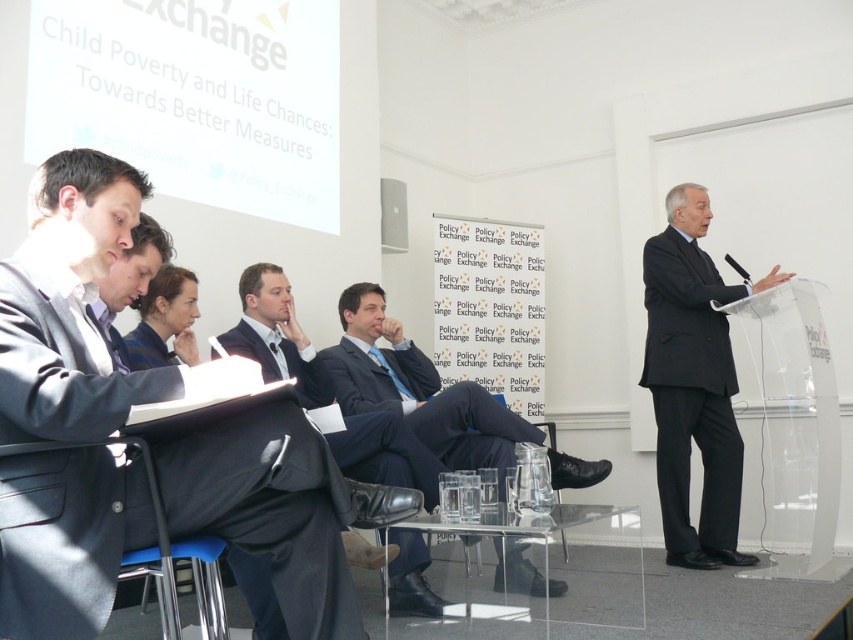
You are an attendee at this event and need to hand a document to both the matte black suit at left and the dark blue suit at center. Since you can only approach one at a time, which person should you approach first to ensure you can reach them without needing to move around the table?

You should approach the matte black suit at left first because they are closer to you than the dark blue suit at center, so you can reach them without needing to move around the table first.

You are attending a formal event where a discussion about child poverty is taking place. You notice a point marked at coordinates [270,509]. What object is located at this specific coordinate?

The object located at point [270,509] is the matte black suit at left.

You are sitting at the back of the room and want to point to a specific location on the table in front of you. There are two points marked on the table labeled as point (386,378) and point (387,444). Which point is closer to you?

Point (386,378) is further to the camera than point (387,444), so the point closer to you would be point (387,444).